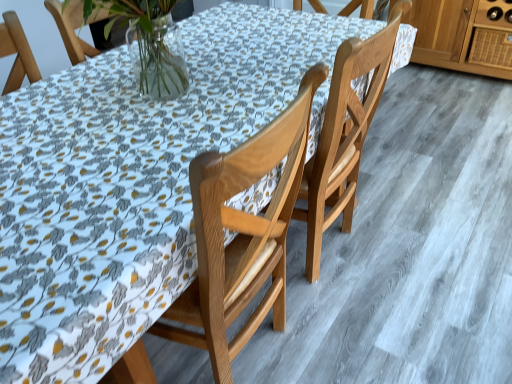
Question: Considering the positions of point (483, 46) and point (278, 233), is point (483, 46) closer or farther from the camera than point (278, 233)?

Choices:
 (A) closer
 (B) farther

Answer: (B)

Question: Looking at their shapes, would you say wooden drawer at upper right is wider or thinner than wooden chair at center, which is the 1th chair from left to right?

Choices:
 (A) thin
 (B) wide

Answer: (A)

Question: Estimate the real-world distances between objects in this image. Which object is farther from the wooden chair at center, acting as the second chair starting from the right?

Choices:
 (A) wooden drawer at upper right
 (B) light brown wood chair at center, arranged as the second chair when viewed from the left

Answer: (A)

Question: Estimate the real-world distances between objects in this image. Which object is farther from the wooden chair at center, acting as the second chair starting from the right?

Choices:
 (A) wooden drawer at upper right
 (B) light brown wood chair at center, arranged as the second chair when viewed from the left

Answer: (A)